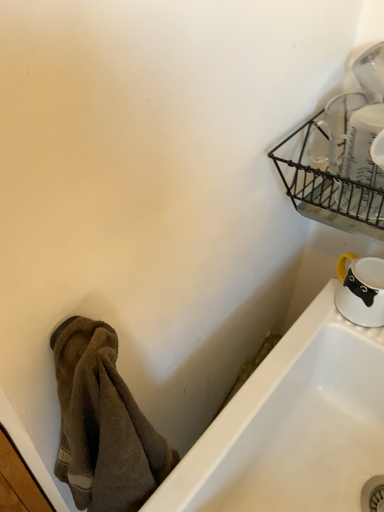
Question: Is brown fuzzy towel at lower left turned away from black wire basket at upper right?

Choices:
 (A) no
 (B) yes

Answer: (A)

Question: Does brown fuzzy towel at lower left have a greater width compared to black wire basket at upper right?

Choices:
 (A) no
 (B) yes

Answer: (A)

Question: Could you tell me if brown fuzzy towel at lower left is facing black wire basket at upper right?

Choices:
 (A) yes
 (B) no

Answer: (B)

Question: Is brown fuzzy towel at lower left shorter than black wire basket at upper right?

Choices:
 (A) no
 (B) yes

Answer: (A)

Question: Considering the relative sizes of brown fuzzy towel at lower left and black wire basket at upper right in the image provided, is brown fuzzy towel at lower left bigger than black wire basket at upper right?

Choices:
 (A) yes
 (B) no

Answer: (A)

Question: From a real-world perspective, is brown fuzzy towel at lower left below black wire basket at upper right?

Choices:
 (A) yes
 (B) no

Answer: (A)

Question: Considering the relative sizes of white glossy mug at lower right, the 2th tableware when ordered from top to bottom, and clear glass measuring cups at upper right, which ranks as the 2th tableware in back-to-front order, in the image provided, is white glossy mug at lower right, the 2th tableware when ordered from top to bottom, wider than clear glass measuring cups at upper right, which ranks as the 2th tableware in back-to-front order,?

Choices:
 (A) yes
 (B) no

Answer: (B)

Question: Considering the relative sizes of white glossy mug at lower right, arranged as the 2th tableware when viewed from the front, and clear glass measuring cups at upper right, which ranks as the 2th tableware in back-to-front order, in the image provided, is white glossy mug at lower right, arranged as the 2th tableware when viewed from the front, bigger than clear glass measuring cups at upper right, which ranks as the 2th tableware in back-to-front order,?

Choices:
 (A) yes
 (B) no

Answer: (B)

Question: From a real-world perspective, is white glossy mug at lower right, acting as the first tableware starting from the bottom, on clear glass measuring cups at upper right, which appears as the first tableware when viewed from the front?

Choices:
 (A) yes
 (B) no

Answer: (B)

Question: Is white glossy mug at lower right, the 2th tableware when ordered from top to bottom, thinner than clear glass measuring cups at upper right, the first tableware in the top-to-bottom sequence?

Choices:
 (A) no
 (B) yes

Answer: (B)

Question: Is white glossy mug at lower right, which is the 1th tableware in back-to-front order, not inside clear glass measuring cups at upper right, the first tableware in the top-to-bottom sequence?

Choices:
 (A) no
 (B) yes

Answer: (B)

Question: Does white glossy mug at lower right, arranged as the 2th tableware when viewed from the front, appear on the right side of clear glass measuring cups at upper right, which appears as the first tableware when viewed from the front?

Choices:
 (A) no
 (B) yes

Answer: (B)

Question: Is white glossy mug at lower right, acting as the first tableware starting from the bottom, positioned before white glossy bathtub at lower right?

Choices:
 (A) yes
 (B) no

Answer: (B)